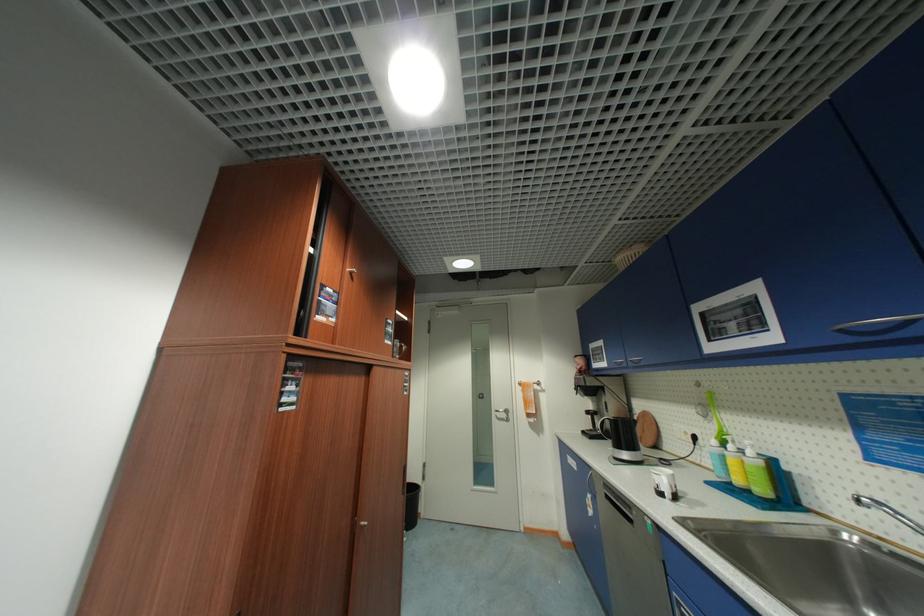
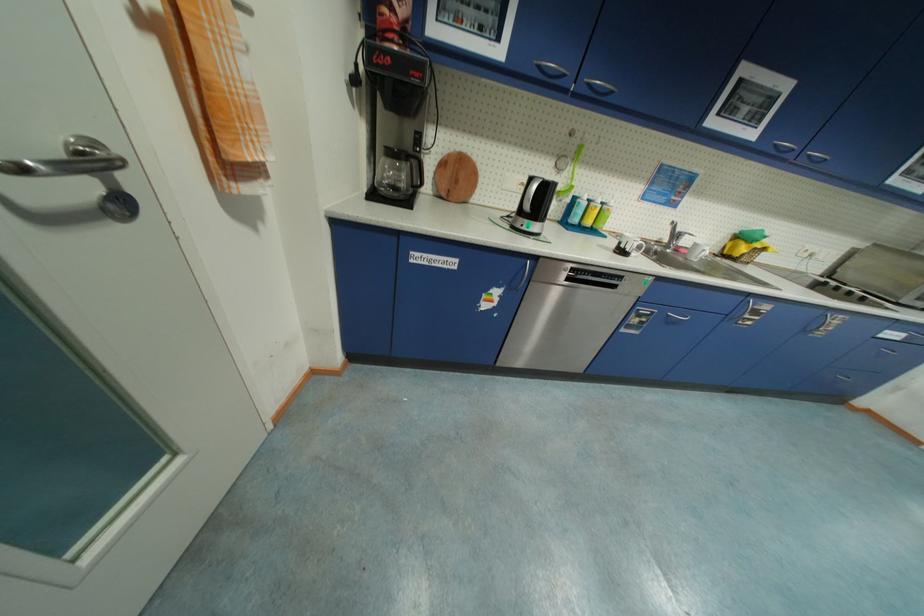
In the second image, find the point that corresponds to point 721,422 in the first image.

(570, 175)